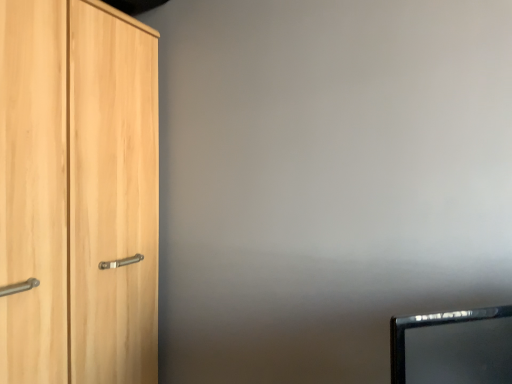
This screenshot has height=384, width=512. What do you see at coordinates (453, 347) in the screenshot? I see `black glossy monitor at lower right` at bounding box center [453, 347].

I want to click on black glossy monitor at lower right, so click(x=453, y=347).

What is the approximate height of black glossy monitor at lower right?

black glossy monitor at lower right is 9.27 inches tall.

Locate an element on the screen. light wood cupboard at left is located at coordinates (78, 193).

Describe the element at coordinates (78, 193) in the screenshot. Image resolution: width=512 pixels, height=384 pixels. I see `light wood cupboard at left` at that location.

What are the coordinates of `black glossy monitor at lower right` in the screenshot? It's located at (453, 347).

Is light wood cupboard at left to the left or to the right of black glossy monitor at lower right in the image?

Clearly, light wood cupboard at left is on the left of black glossy monitor at lower right in the image.

Between light wood cupboard at left and black glossy monitor at lower right, which one is positioned in front?

black glossy monitor at lower right is more forward.

Which point is more distant from viewer, (98, 135) or (426, 316)?

The point (98, 135) is behind.

From the image's perspective, is light wood cupboard at left beneath black glossy monitor at lower right?

No, from the image's perspective, light wood cupboard at left is not below black glossy monitor at lower right.

From a real-world perspective, does light wood cupboard at left sit lower than black glossy monitor at lower right?

Incorrect, from a real-world perspective, light wood cupboard at left is higher than black glossy monitor at lower right.

Looking at their sizes, would you say light wood cupboard at left is wider or thinner than black glossy monitor at lower right?

Clearly, light wood cupboard at left has more width compared to black glossy monitor at lower right.

Who is shorter, light wood cupboard at left or black glossy monitor at lower right?

Standing shorter between the two is black glossy monitor at lower right.

Does light wood cupboard at left have a larger size compared to black glossy monitor at lower right?

Indeed, light wood cupboard at left has a larger size compared to black glossy monitor at lower right.

Is light wood cupboard at left not within black glossy monitor at lower right?

light wood cupboard at left is positioned outside black glossy monitor at lower right.

Are light wood cupboard at left and black glossy monitor at lower right located far from each other?

They are positioned close to each other.

Consider the image. Does light wood cupboard at left turn towards black glossy monitor at lower right?

Yes.

How many degrees apart are the facing directions of light wood cupboard at left and black glossy monitor at lower right?

There is a 47.2-degree angle between the facing directions of light wood cupboard at left and black glossy monitor at lower right.

How distant is light wood cupboard at left from black glossy monitor at lower right?

The distance of light wood cupboard at left from black glossy monitor at lower right is 37.98 inches.

I want to click on computer monitor on the right side of light wood cupboard at left, so click(453, 347).

Which object is positioned more to the right, black glossy monitor at lower right or light wood cupboard at left?

Positioned to the right is black glossy monitor at lower right.

Which object is closer to the camera, black glossy monitor at lower right or light wood cupboard at left?

black glossy monitor at lower right is closer to the camera.

Which is less distant, (426, 338) or (24, 1)?

Positioned in front is point (426, 338).

From the image's perspective, is black glossy monitor at lower right over light wood cupboard at left?

No, from the image's perspective, black glossy monitor at lower right is not above light wood cupboard at left.

Consider the image. From a real-world perspective, is black glossy monitor at lower right above or below light wood cupboard at left?

black glossy monitor at lower right is below light wood cupboard at left.

Consider the image. Considering the relative sizes of black glossy monitor at lower right and light wood cupboard at left in the image provided, is black glossy monitor at lower right wider than light wood cupboard at left?

No.

Which of these two, black glossy monitor at lower right or light wood cupboard at left, stands taller?

light wood cupboard at left is taller.

Can you confirm if black glossy monitor at lower right is bigger than light wood cupboard at left?

No, black glossy monitor at lower right is not bigger than light wood cupboard at left.

Is black glossy monitor at lower right inside the boundaries of light wood cupboard at left, or outside?

black glossy monitor at lower right is spatially situated outside light wood cupboard at left.

Is black glossy monitor at lower right touching light wood cupboard at left?

No, black glossy monitor at lower right is not making contact with light wood cupboard at left.

Is black glossy monitor at lower right positioned with its back to light wood cupboard at left?

No, black glossy monitor at lower right is not facing away from light wood cupboard at left.

Looking at this image, can you tell me how much black glossy monitor at lower right and light wood cupboard at left differ in facing direction?

There is a 47.2-degree angle between the facing directions of black glossy monitor at lower right and light wood cupboard at left.

This screenshot has width=512, height=384. Find the location of `cupboard lying above the black glossy monitor at lower right (from the image's perspective)`. cupboard lying above the black glossy monitor at lower right (from the image's perspective) is located at coordinates (78, 193).

Identify the location of cupboard behind the black glossy monitor at lower right. This screenshot has width=512, height=384. (78, 193).

Where is `cupboard located above the black glossy monitor at lower right (from a real-world perspective)`? This screenshot has width=512, height=384. cupboard located above the black glossy monitor at lower right (from a real-world perspective) is located at coordinates (78, 193).